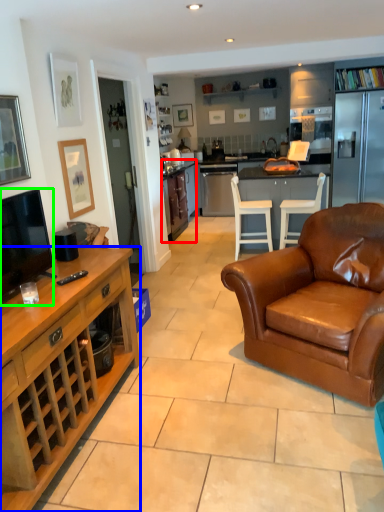
Question: Which object is positioned farthest from cabinetry (highlighted by a red box)? Select from cabinetry (highlighted by a blue box) and television (highlighted by a green box).

Choices:
 (A) cabinetry
 (B) television

Answer: (B)